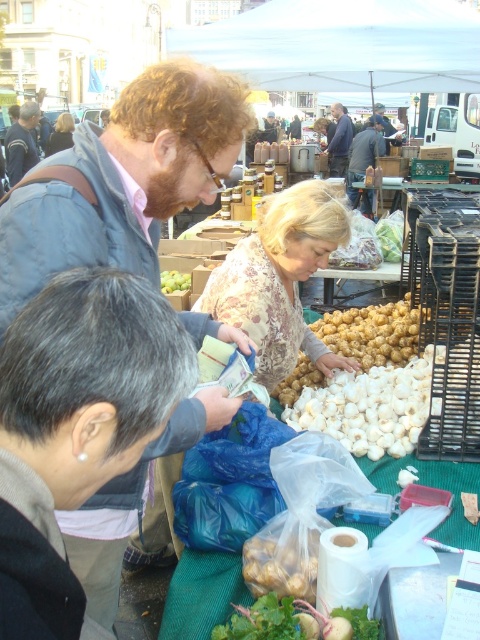
Is white fabric canopy at upper center positioned at the back of green matte garlic at center?

That is True.

Who is positioned more to the right, white fabric canopy at upper center or green matte garlic at center?

Positioned to the right is white fabric canopy at upper center.

Which is behind, point (371, 52) or point (188, 289)?

Positioned behind is point (371, 52).

Identify the location of white fabric canopy at upper center. Image resolution: width=480 pixels, height=640 pixels. (342, 45).

Who is positioned more to the left, dark blue jeans at center or green matte garlic at center?

green matte garlic at center

Can you confirm if dark blue jeans at center is positioned to the right of green matte garlic at center?

Correct, you'll find dark blue jeans at center to the right of green matte garlic at center.

Locate an element on the screen. dark blue jeans at center is located at coordinates (363, 154).

Which is more to the left, dark blue jeans at center or matte brown jacket at upper left?

matte brown jacket at upper left

The width and height of the screenshot is (480, 640). What do you see at coordinates (363, 154) in the screenshot?
I see `dark blue jeans at center` at bounding box center [363, 154].

Image resolution: width=480 pixels, height=640 pixels. Find the location of `dark blue jeans at center`. dark blue jeans at center is located at coordinates (363, 154).